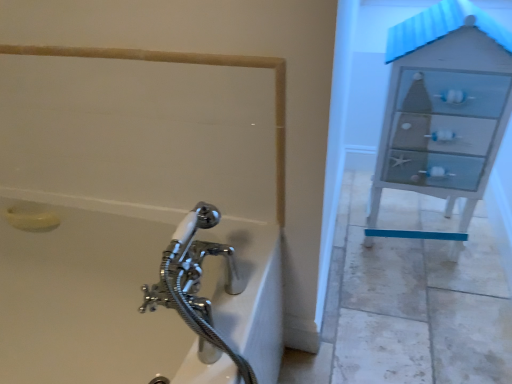
I want to click on vacant space in front of white glossy file cabinet at right, so click(432, 305).